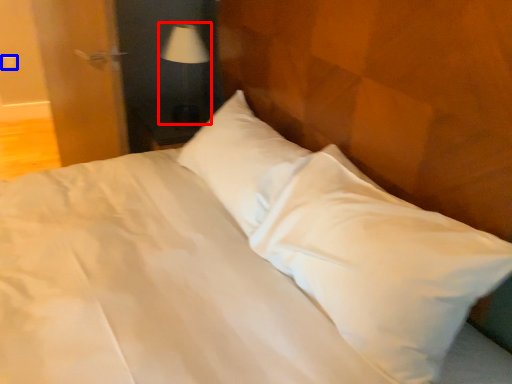
Question: Which point is closer to the camera, table lamp (highlighted by a red box) or electric outlet (highlighted by a blue box)?

Choices:
 (A) table lamp
 (B) electric outlet

Answer: (A)